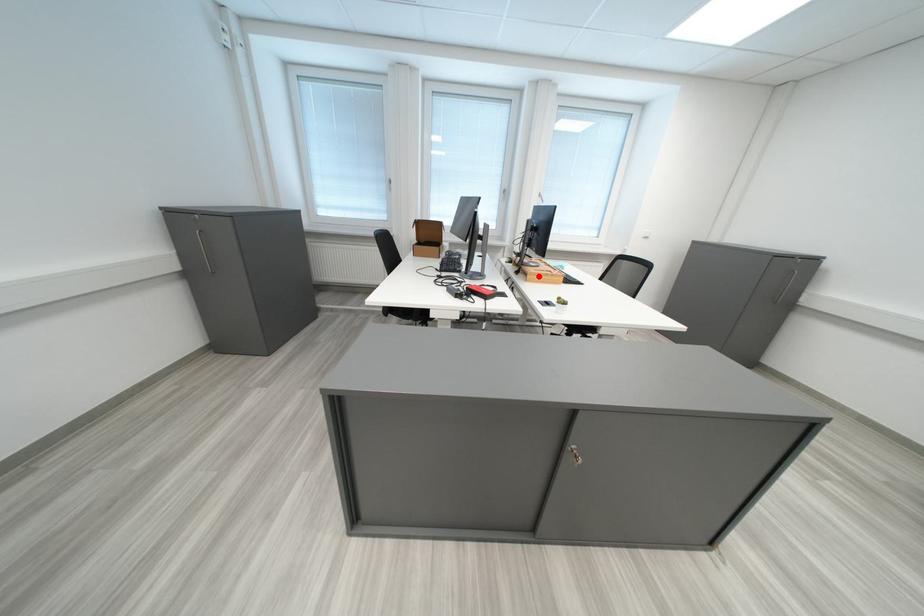
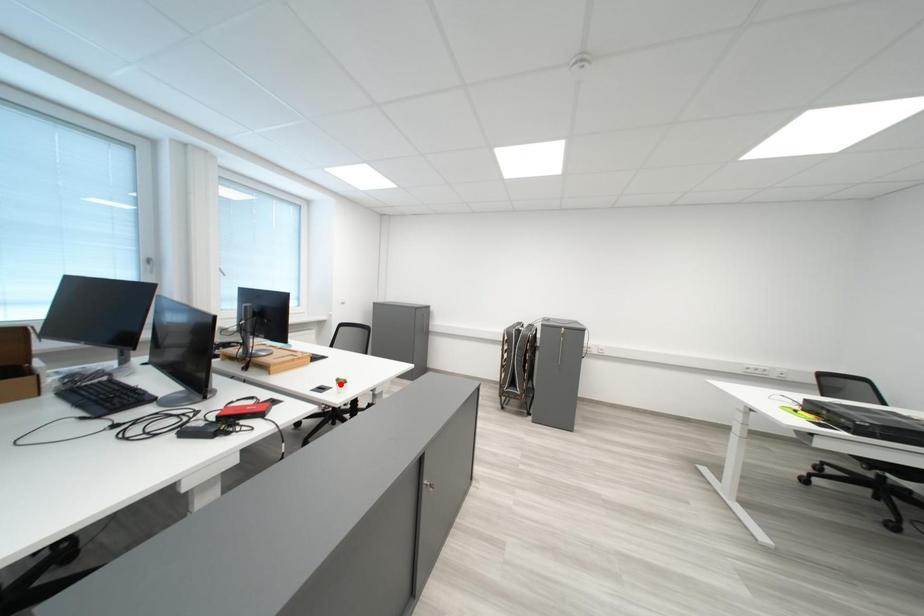
I am providing you with two images of the same scene from different viewpoints. A red point is marked on the first image and another point is marked on the second image. Is the red point in image1 aligned with the point shown in image2?

No